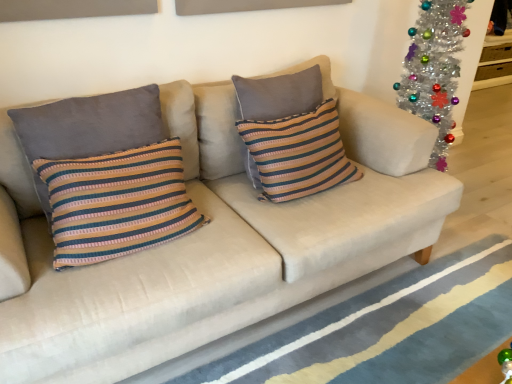
Question: Is striped fabric pillow at left, which is the second pillow in right-to-left order, touching blue striped rug at lower center?

Choices:
 (A) yes
 (B) no

Answer: (B)

Question: Could you tell me if striped fabric pillow at left, acting as the first pillow starting from the left, is turned towards blue striped rug at lower center?

Choices:
 (A) yes
 (B) no

Answer: (B)

Question: Is striped fabric pillow at left, acting as the first pillow starting from the left, wider than blue striped rug at lower center?

Choices:
 (A) yes
 (B) no

Answer: (B)

Question: Can you confirm if striped fabric pillow at left, which is the second pillow in right-to-left order, is shorter than blue striped rug at lower center?

Choices:
 (A) no
 (B) yes

Answer: (A)

Question: From the image's perspective, would you say striped fabric pillow at left, which is the second pillow in right-to-left order, is shown under blue striped rug at lower center?

Choices:
 (A) no
 (B) yes

Answer: (A)

Question: Is blue striped rug at lower center wider or thinner than striped fabric pillow at center, positioned as the 1th pillow in right-to-left order?

Choices:
 (A) thin
 (B) wide

Answer: (B)

Question: Is point (295, 342) positioned closer to the camera than point (298, 134)?

Choices:
 (A) farther
 (B) closer

Answer: (B)

Question: In the image, is blue striped rug at lower center positioned in front of or behind striped fabric pillow at center, the second pillow positioned from the left?

Choices:
 (A) behind
 (B) front

Answer: (B)

Question: From a real-world perspective, is blue striped rug at lower center physically located above or below striped fabric pillow at center, the second pillow positioned from the left?

Choices:
 (A) above
 (B) below

Answer: (B)

Question: Looking at their shapes, would you say striped fabric pillow at left, which is the second pillow in right-to-left order, is wider or thinner than striped fabric pillow at center, positioned as the 1th pillow in right-to-left order?

Choices:
 (A) thin
 (B) wide

Answer: (A)

Question: Relative to striped fabric pillow at center, positioned as the 1th pillow in right-to-left order, is striped fabric pillow at left, which is the second pillow in right-to-left order, in front or behind?

Choices:
 (A) front
 (B) behind

Answer: (A)

Question: In terms of height, does striped fabric pillow at left, which is the second pillow in right-to-left order, look taller or shorter compared to striped fabric pillow at center, positioned as the 1th pillow in right-to-left order?

Choices:
 (A) short
 (B) tall

Answer: (A)

Question: Would you say striped fabric pillow at left, which is the second pillow in right-to-left order, is inside or outside striped fabric pillow at center, positioned as the 1th pillow in right-to-left order?

Choices:
 (A) outside
 (B) inside

Answer: (A)

Question: Is striped fabric pillow at left, acting as the first pillow starting from the left, inside the boundaries of blue striped rug at lower center, or outside?

Choices:
 (A) inside
 (B) outside

Answer: (B)

Question: Is striped fabric pillow at left, acting as the first pillow starting from the left, bigger or smaller than blue striped rug at lower center?

Choices:
 (A) big
 (B) small

Answer: (B)